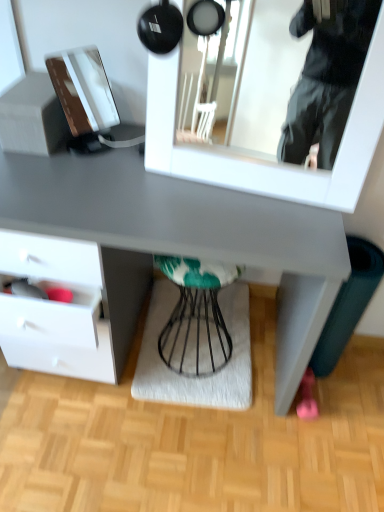
Question: Based on their positions, is white glossy mirror at upper center located to the left or right of teal fabric stool at center?

Choices:
 (A) left
 (B) right

Answer: (B)

Question: In terms of size, does white glossy mirror at upper center appear bigger or smaller than teal fabric stool at center?

Choices:
 (A) small
 (B) big

Answer: (B)

Question: Estimate the real-world distances between objects in this image. Which object is closer to the teal fabric stool at center?

Choices:
 (A) matte gray desk at center
 (B) textured gray mat at center
 (C) white glossy mirror at upper center

Answer: (B)

Question: Estimate the real-world distances between objects in this image. Which object is farther from the teal fabric stool at center?

Choices:
 (A) textured gray mat at center
 (B) white glossy mirror at upper center
 (C) matte gray desk at center

Answer: (B)